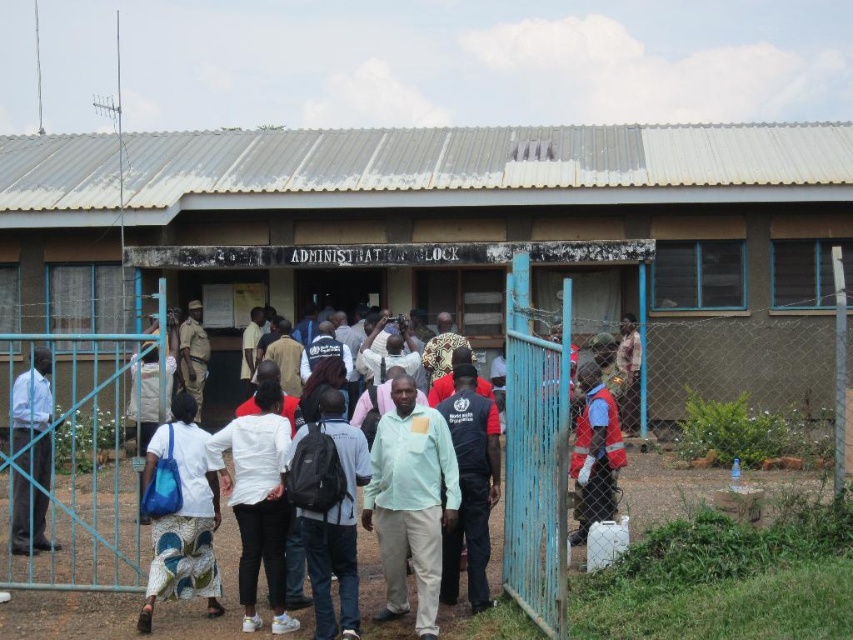
You are standing at the entrance of the ADMINISTRATION BLOCK and see a black backpack at center and a camouflage fabric shirt at center. How far apart are these two items from each other?

The black backpack at center is 7.76 meters away from the camouflage fabric shirt at center.

You are standing at the entrance of the ADMINISTRATION BLOCK and see a black backpack at center. Where is the black backpack located in relation to the entrance?

The black backpack at center is located at the point (335, 525) in 2D coordinates relative to the entrance.

You are standing at the entrance of the ADMINISTRATION BLOCK and want to enter. Where is the blue metal gate at center located in relation to your current position?

The blue metal gate at center is located at point (728, 580), so it is positioned to your right side as you face the entrance.